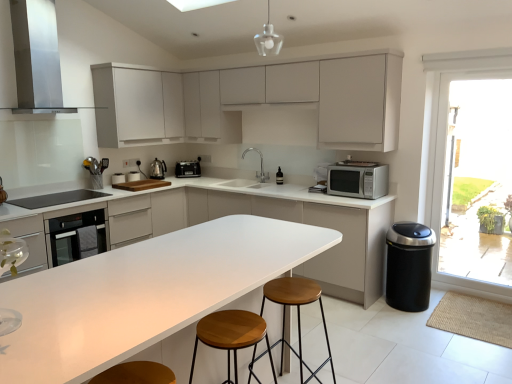
Question: Considering the relative sizes of silver metallic faucet at center and transparent glass door at right in the image provided, is silver metallic faucet at center bigger than transparent glass door at right?

Choices:
 (A) yes
 (B) no

Answer: (B)

Question: Does silver metallic faucet at center have a lesser height compared to transparent glass door at right?

Choices:
 (A) no
 (B) yes

Answer: (B)

Question: Is silver metallic faucet at center completely or partially outside of transparent glass door at right?

Choices:
 (A) yes
 (B) no

Answer: (A)

Question: Could you tell me if silver metallic faucet at center is facing transparent glass door at right?

Choices:
 (A) yes
 (B) no

Answer: (B)

Question: Is silver metallic faucet at center thinner than transparent glass door at right?

Choices:
 (A) no
 (B) yes

Answer: (A)

Question: Is stainless steel range hood at upper left inside the boundaries of transparent glass door at right, or outside?

Choices:
 (A) outside
 (B) inside

Answer: (A)

Question: Is stainless steel range hood at upper left bigger or smaller than transparent glass door at right?

Choices:
 (A) small
 (B) big

Answer: (B)

Question: Considering the positions of point (44, 105) and point (474, 160), is point (44, 105) closer or farther from the camera than point (474, 160)?

Choices:
 (A) farther
 (B) closer

Answer: (B)

Question: From the image's perspective, is stainless steel range hood at upper left located above or below transparent glass door at right?

Choices:
 (A) above
 (B) below

Answer: (A)

Question: In the image, is white matte cabinet at upper center, which is the 1th cabinetry from top to bottom, positioned in front of or behind black glass cooktop at left?

Choices:
 (A) behind
 (B) front

Answer: (A)

Question: From a real-world perspective, is white matte cabinet at upper center, acting as the third cabinetry starting from the bottom, physically located above or below black glass cooktop at left?

Choices:
 (A) above
 (B) below

Answer: (A)

Question: In terms of height, does white matte cabinet at upper center, acting as the third cabinetry starting from the bottom, look taller or shorter compared to black glass cooktop at left?

Choices:
 (A) tall
 (B) short

Answer: (A)

Question: Choose the correct answer: Is white matte cabinet at upper center, acting as the third cabinetry starting from the bottom, inside black glass cooktop at left or outside it?

Choices:
 (A) inside
 (B) outside

Answer: (B)

Question: Looking at their shapes, would you say stainless steel range hood at upper left is wider or thinner than white matte cabinet at center, placed as the 1th cabinetry when sorted from bottom to top?

Choices:
 (A) thin
 (B) wide

Answer: (A)

Question: Choose the correct answer: Is stainless steel range hood at upper left inside white matte cabinet at center, the third cabinetry when ordered from top to bottom, or outside it?

Choices:
 (A) inside
 (B) outside

Answer: (B)